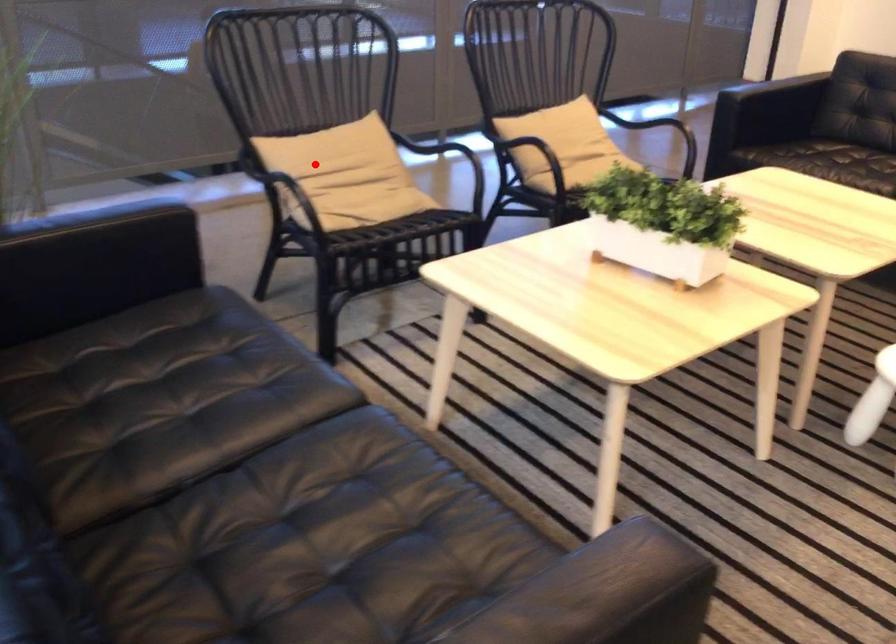
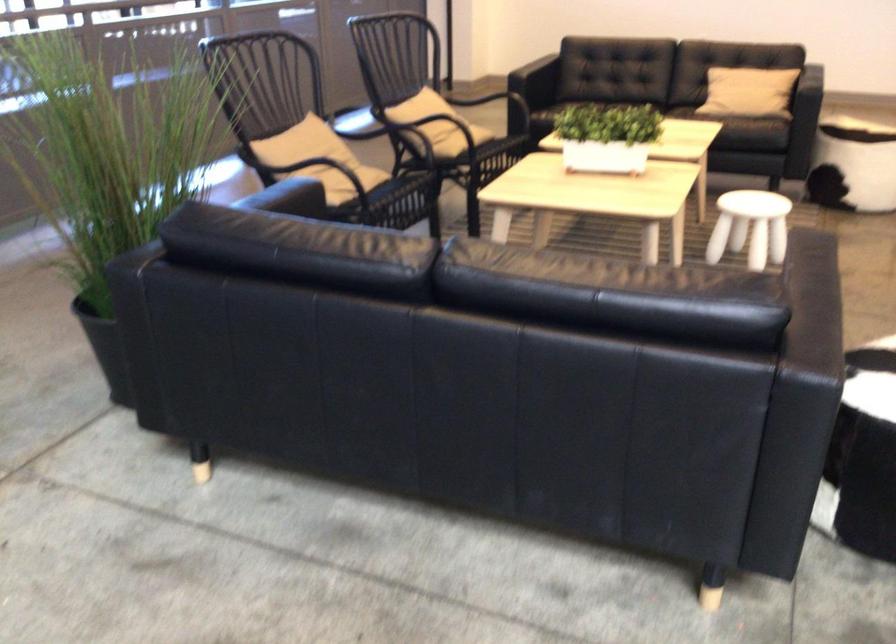
Where in the second image is the point corresponding to the highlighted location from the first image?

(308, 153)